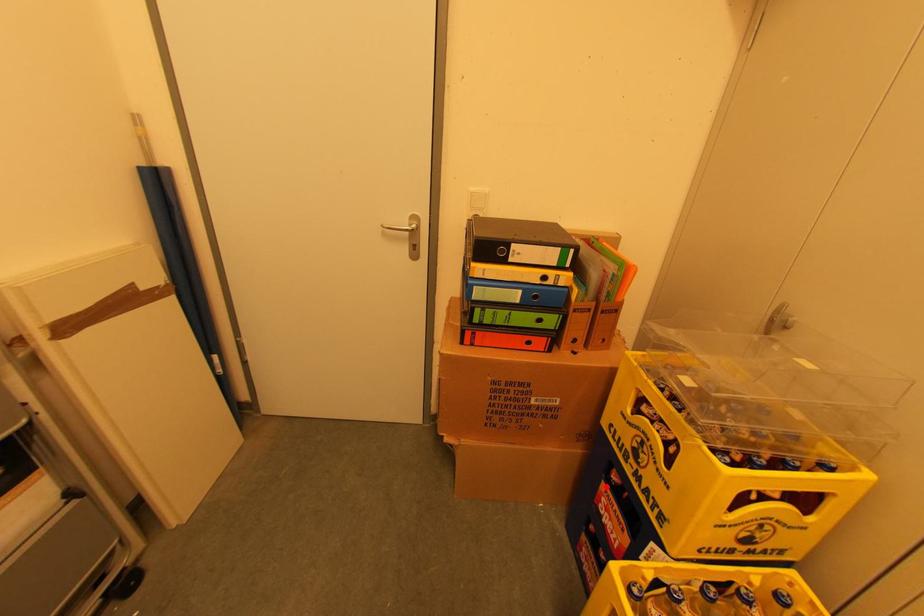
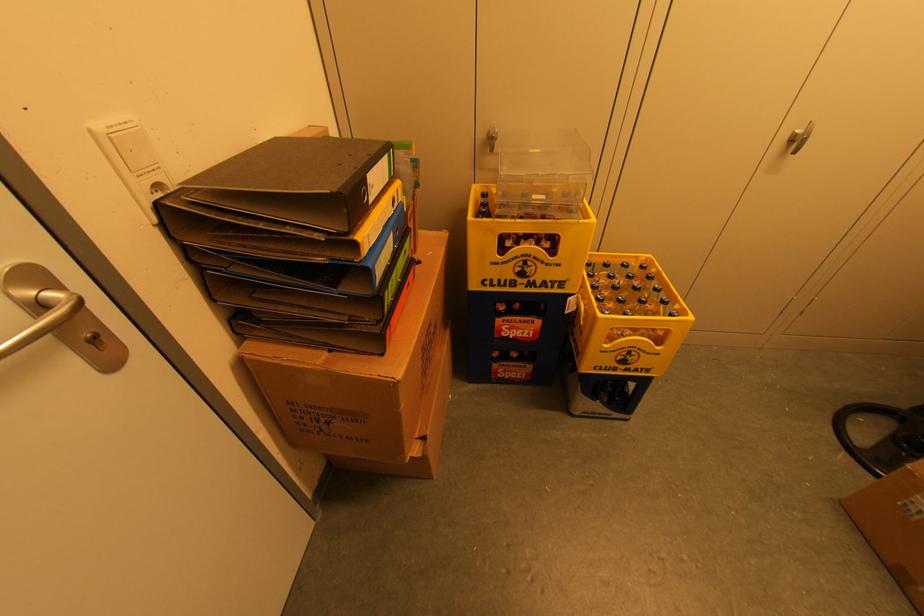
The point at the highlighted location is marked in the first image. Where is the corresponding point in the second image?

(501, 322)